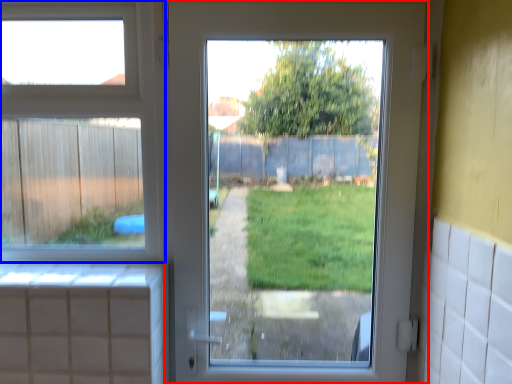
Question: Which object is closer to the camera taking this photo, door (highlighted by a red box) or window (highlighted by a blue box)?

Choices:
 (A) door
 (B) window

Answer: (A)